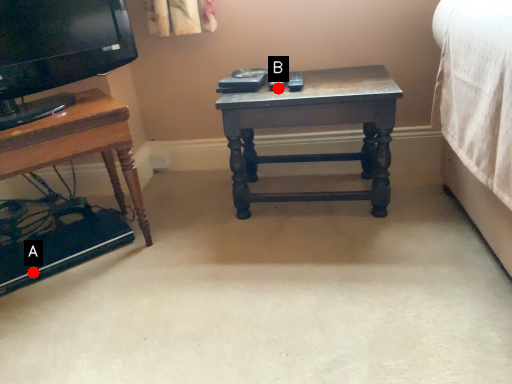
Question: Two points are circled on the image, labeled by A and B beside each circle. Which point is farther from the camera taking this photo?

Choices:
 (A) A is further
 (B) B is further

Answer: (B)